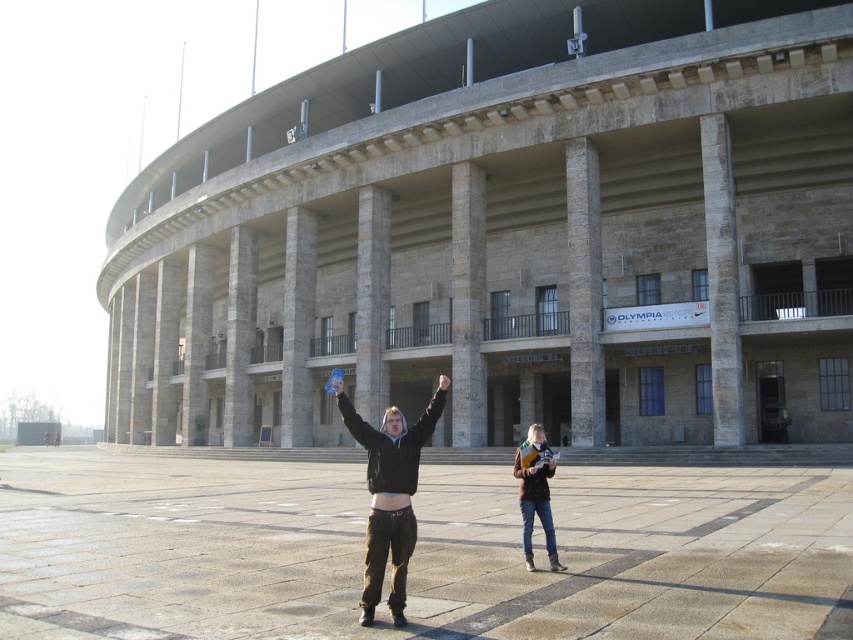
Question: Is stone gray stadium at center above smooth skin hand at center?

Choices:
 (A) no
 (B) yes

Answer: (B)

Question: Estimate the real-world distances between objects in this image. Which object is closer to the black matte arm at center?

Choices:
 (A) stone gray stadium at center
 (B) brown leather jacket at center
 (C) dark brown hoodie at center
 (D) matte black hoodie at center

Answer: (B)

Question: Is stone gray stadium at center positioned behind brown leather jacket at center?

Choices:
 (A) yes
 (B) no

Answer: (A)

Question: Among these points, which one is nearest to the camera?

Choices:
 (A) (444, 380)
 (B) (433, 432)
 (C) (335, 392)
 (D) (358, 419)

Answer: (C)

Question: Does stone gray stadium at center have a greater width compared to brown leather jacket at center?

Choices:
 (A) yes
 (B) no

Answer: (A)

Question: Among these objects, which one is farthest from the camera?

Choices:
 (A) smooth skin hand at center
 (B) stone gray stadium at center

Answer: (B)